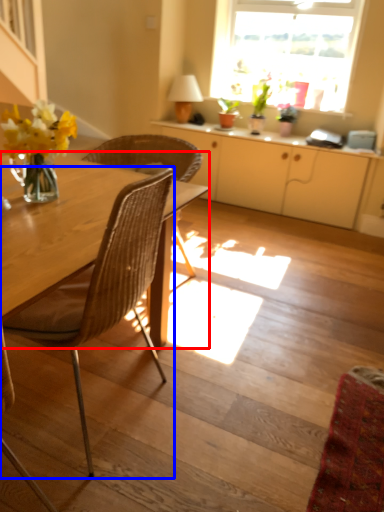
Question: Which point is further to the camera, round table (highlighted by a red box) or chair (highlighted by a blue box)?

Choices:
 (A) round table
 (B) chair

Answer: (A)